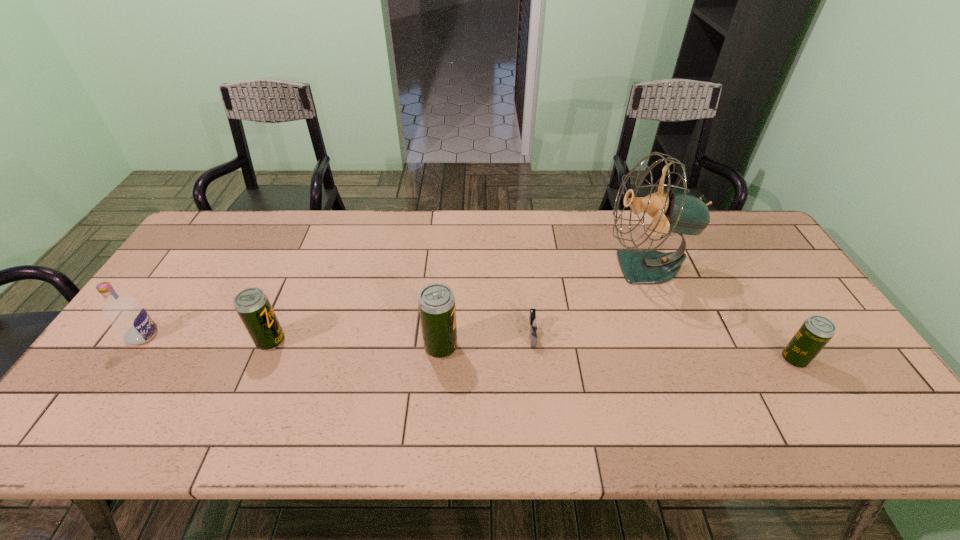
The height and width of the screenshot is (540, 960). What are the coordinates of `free space located 0.230m on the right of the fifth object from right to left` in the screenshot? It's located at (372, 341).

Locate an element on the screen. Image resolution: width=960 pixels, height=540 pixels. vacant point located 0.090m on the left of the third object from left to right is located at coordinates (390, 347).

Image resolution: width=960 pixels, height=540 pixels. Find the location of `vacant area situated on the back of the shortest beer can`. vacant area situated on the back of the shortest beer can is located at coordinates (761, 307).

The width and height of the screenshot is (960, 540). Identify the location of blank area located on the left of the fourth object from left to right. (421, 334).

This screenshot has height=540, width=960. Find the location of `vacant space located 0.350m on the front-facing side of the farthest object for air flow`. vacant space located 0.350m on the front-facing side of the farthest object for air flow is located at coordinates (490, 267).

Identify the location of vacant space situated 0.060m on the front-facing side of the farthest object for air flow. (584, 267).

In order to click on vacant area situated 0.190m on the front-facing side of the farthest object for air flow in this screenshot , I will do `click(541, 267)`.

Locate an element on the screen. The width and height of the screenshot is (960, 540). free space located 0.270m on the label of the vodka is located at coordinates [259, 335].

You are a GUI agent. You are given a task and a screenshot of the screen. Output one action in this format:
    pyautogui.click(x=<x>, y=<y>)
    Task: Click on the object located at the far edge
    
    Given the screenshot: What is the action you would take?
    click(673, 211)

This screenshot has height=540, width=960. In order to click on object present at the left edge in this screenshot , I will do `click(124, 313)`.